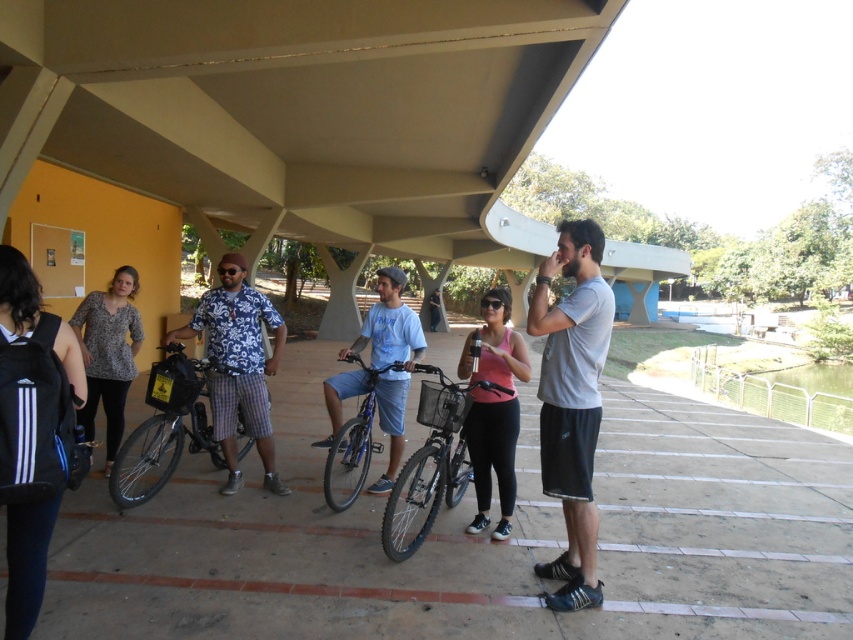
Question: Which object is farther from the camera taking this photo?

Choices:
 (A) pink matte tank top at center
 (B) hawaiian shirt at center
 (C) gray matte t-shirt at center

Answer: (B)

Question: Does hawaiian shirt at center have a greater width compared to silver metallic bicycle at center?

Choices:
 (A) yes
 (B) no

Answer: (A)

Question: Can you confirm if silver metallic bicycle at center is positioned above metallic silver bicycle at center?

Choices:
 (A) yes
 (B) no

Answer: (A)

Question: Which point is farther to the camera?

Choices:
 (A) (193, 392)
 (B) (328, 504)
 (C) (251, 420)
 (D) (560, 422)

Answer: (C)

Question: Is pink matte tank top at center above metallic silver bicycle at center?

Choices:
 (A) yes
 (B) no

Answer: (A)

Question: Which object appears farthest from the camera in this image?

Choices:
 (A) gray matte t-shirt at center
 (B) metallic silver bicycle at center
 (C) silver metallic bicycle at center

Answer: (B)